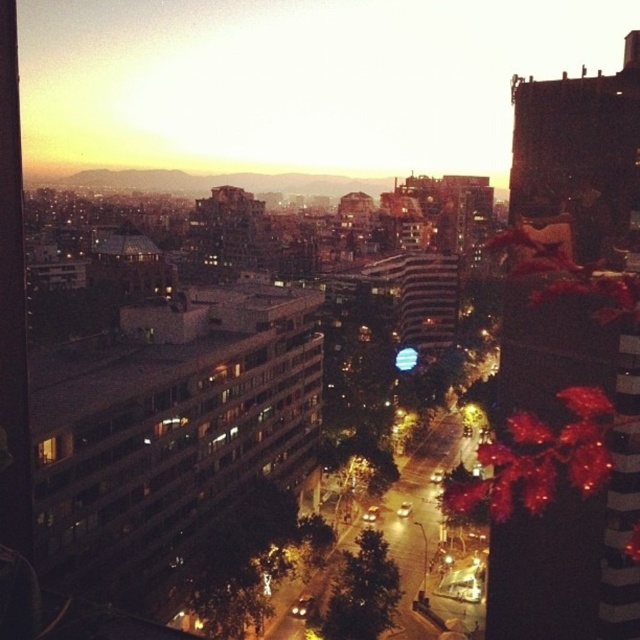
Question: From the image, what is the correct spatial relationship of matte glass building at center-left in relation to shiny red leaves at right?

Choices:
 (A) below
 (B) above

Answer: (B)

Question: Among these objects, which one is nearest to the camera?

Choices:
 (A) matte glass building at center-left
 (B) shiny red leaves at right
 (C) matte glass window at upper center

Answer: (B)

Question: Which point appears farthest from the camera in this image?

Choices:
 (A) (170, 540)
 (B) (506, 509)
 (C) (108, 54)

Answer: (C)

Question: Observing the image, what is the correct spatial positioning of matte glass window at upper center in reference to shiny red leaves at right?

Choices:
 (A) above
 (B) below

Answer: (A)

Question: Considering the relative positions of matte glass window at upper center and shiny red leaves at right in the image provided, where is matte glass window at upper center located with respect to shiny red leaves at right?

Choices:
 (A) left
 (B) right

Answer: (A)

Question: Which point is farther from the camera taking this photo?

Choices:
 (A) (108, 428)
 (B) (556, 452)

Answer: (A)